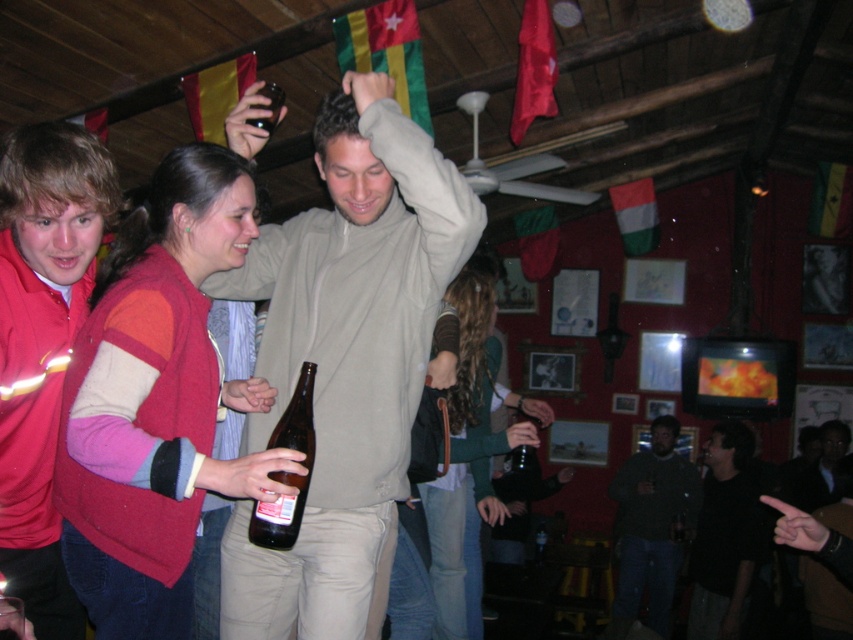
Can you confirm if matte beige sweater at center is taller than brown glass bottle at upper center?

Yes, matte beige sweater at center is taller than brown glass bottle at upper center.

Is matte beige sweater at center thinner than brown glass bottle at upper center?

No.

Is point (375, 225) closer to camera compared to point (265, 129)?

Yes, point (375, 225) is closer to viewer.

Where is `matte beige sweater at center`? The height and width of the screenshot is (640, 853). matte beige sweater at center is located at coordinates (346, 358).

Can you confirm if dark green sweater at center is thinner than brown glass bottle at upper center?

No, dark green sweater at center is not thinner than brown glass bottle at upper center.

Is the position of dark green sweater at center less distant than that of brown glass bottle at upper center?

No, it is not.

You are a GUI agent. You are given a task and a screenshot of the screen. Output one action in this format:
    pyautogui.click(x=<x>, y=<y>)
    Task: Click on the dark green sweater at center
    The height and width of the screenshot is (640, 853).
    Given the screenshot: What is the action you would take?
    pyautogui.click(x=653, y=524)

Can you confirm if green textured sweater at center is shorter than black matte shirt at lower right?

No.

This screenshot has height=640, width=853. What do you see at coordinates (469, 456) in the screenshot?
I see `green textured sweater at center` at bounding box center [469, 456].

At what (x,y) coordinates should I click in order to perform the action: click on green textured sweater at center. Please return your answer as a coordinate pair (x, y). This screenshot has height=640, width=853. Looking at the image, I should click on (469, 456).